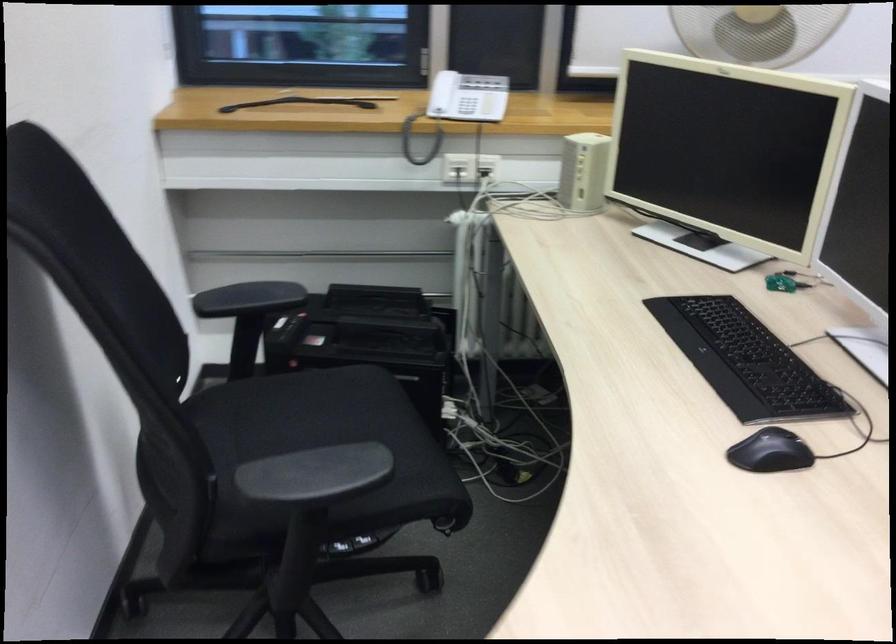
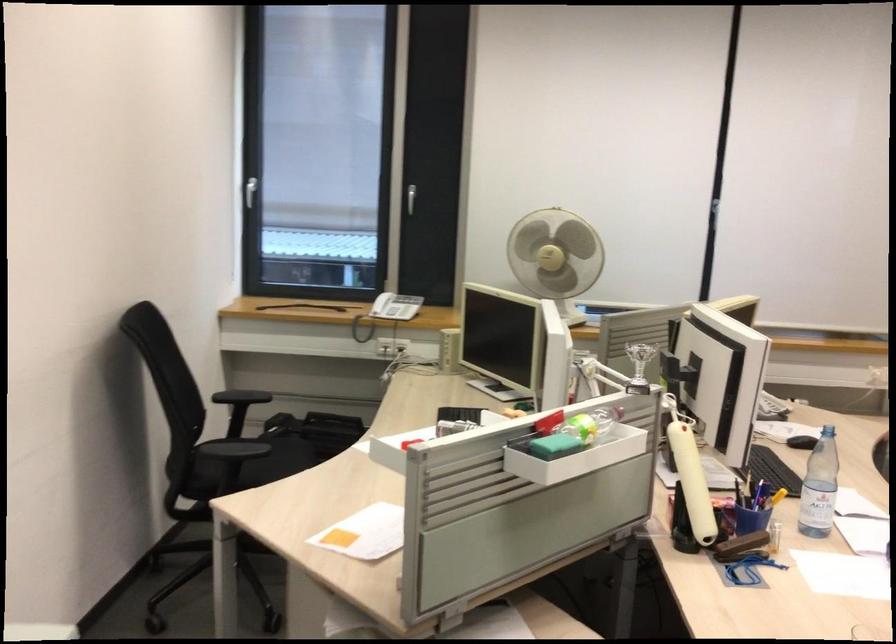
Question: I am providing you with two images of the same scene from different viewpoints. Please identify which objects are invisible in image2.

Choices:
 (A) white desk fan
 (B) green sponge
 (C) black chair armrest
 (D) none of these

Answer: (D)